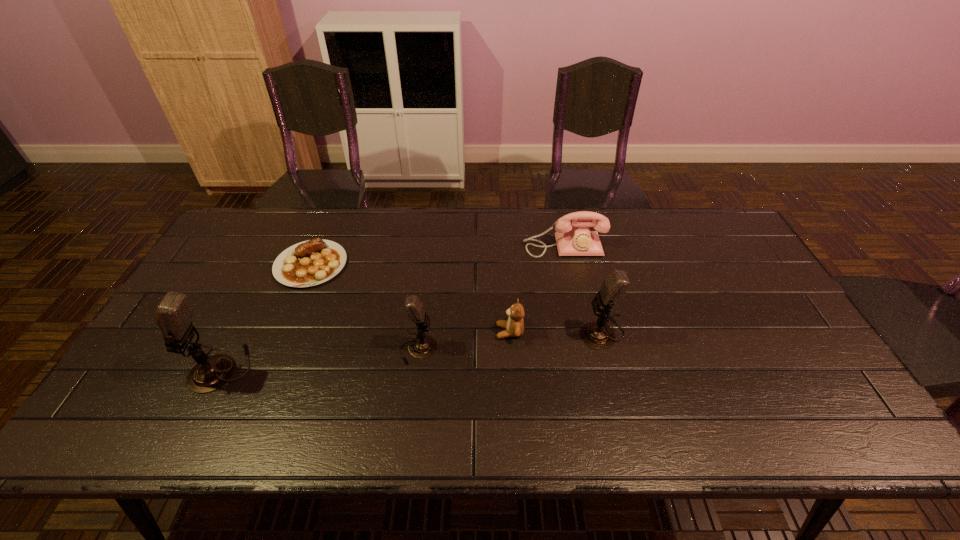
The image size is (960, 540). In the image, there is a desktop. In order to click on vacant space at the right edge in this screenshot , I will do `click(705, 266)`.

Image resolution: width=960 pixels, height=540 pixels. In order to click on vacant space at the far right corner of the desktop in this screenshot , I will do `click(680, 220)`.

Identify the location of empty location between the second shortest object and the telephone. (537, 289).

This screenshot has width=960, height=540. I want to click on free space between the tallest object and the fourth tallest object, so click(393, 308).

You are a GUI agent. You are given a task and a screenshot of the screen. Output one action in this format:
    pyautogui.click(x=<x>, y=<y>)
    Task: Click on the free space between the fourth shortest object and the teddy bear
    This screenshot has width=960, height=540.
    Given the screenshot: What is the action you would take?
    pyautogui.click(x=464, y=341)

You are a GUI agent. You are given a task and a screenshot of the screen. Output one action in this format:
    pyautogui.click(x=<x>, y=<y>)
    Task: Click on the free space between the steak and the leftmost microphone
    The image size is (960, 540).
    Given the screenshot: What is the action you would take?
    pyautogui.click(x=266, y=316)

Find the location of `empty location between the shortest object and the third object from left to right`. empty location between the shortest object and the third object from left to right is located at coordinates (365, 307).

Image resolution: width=960 pixels, height=540 pixels. I want to click on free space between the third object from left to right and the steak, so click(x=365, y=307).

At what (x,y) coordinates should I click in order to perform the action: click on empty space that is in between the shortest object and the telephone. Please return your answer as a coordinate pair (x, y). This screenshot has width=960, height=540. Looking at the image, I should click on (438, 255).

Identify the location of vacant space that's between the second shortest object and the tallest microphone. (366, 350).